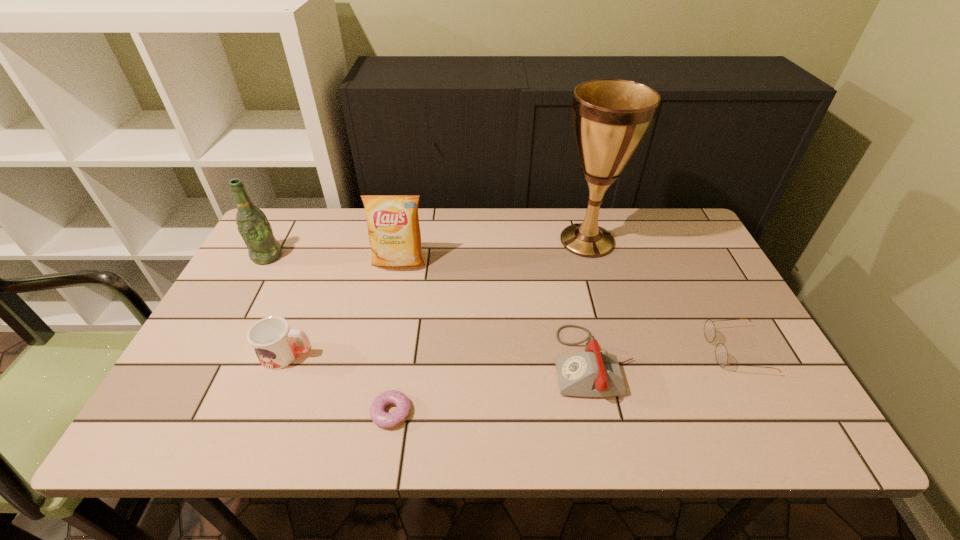
Locate an element on the screen. The width and height of the screenshot is (960, 540). vacant area situated on the right of the doughnut is located at coordinates (501, 412).

At what (x,y) coordinates should I click in order to perform the action: click on trophy cup that is positioned at the far edge. Please return your answer as a coordinate pair (x, y). Looking at the image, I should click on (611, 117).

Where is `beer bottle present at the far edge`? The width and height of the screenshot is (960, 540). beer bottle present at the far edge is located at coordinates (253, 226).

This screenshot has width=960, height=540. Identify the location of crisp (potato chip) positioned at the far edge. (394, 233).

Where is `telephone situated at the near edge`? telephone situated at the near edge is located at coordinates (593, 373).

Locate an element on the screen. This screenshot has height=540, width=960. doughnut that is at the near edge is located at coordinates (378, 415).

At what (x,y) coordinates should I click in order to perform the action: click on beer bottle present at the left edge. Please return your answer as a coordinate pair (x, y). The width and height of the screenshot is (960, 540). Looking at the image, I should click on (253, 226).

Find the location of a particular element. This screenshot has height=540, width=960. mug located at the left edge is located at coordinates (272, 340).

Where is `object situated at the right edge`? Image resolution: width=960 pixels, height=540 pixels. object situated at the right edge is located at coordinates (721, 354).

You are a GUI agent. You are given a task and a screenshot of the screen. Output one action in this format:
    pyautogui.click(x=<x>, y=<y>)
    Task: Click on the object present at the far left corner
    The image size is (960, 540).
    Given the screenshot: What is the action you would take?
    pyautogui.click(x=253, y=226)